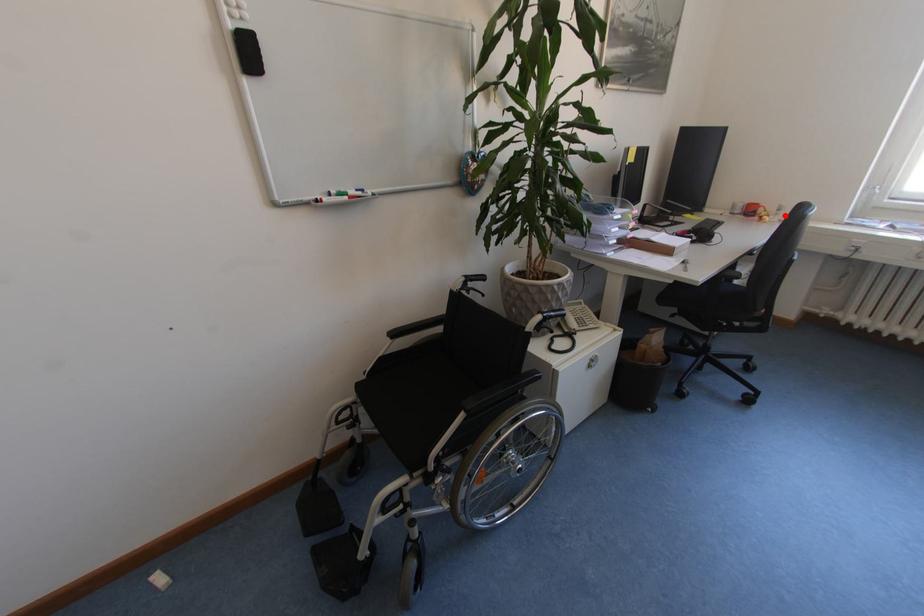
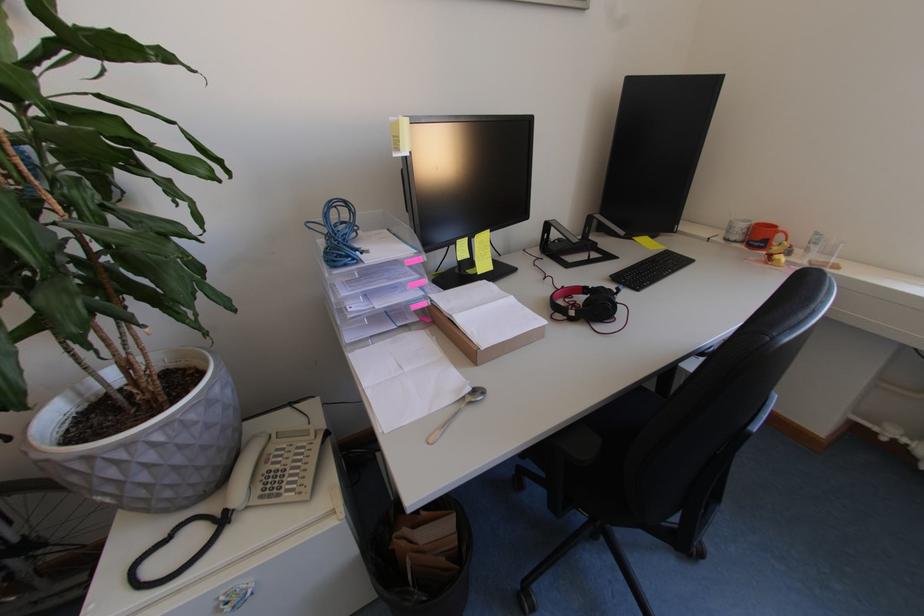
Find the pixel in the second image that matches the highlighted location in the first image.

(816, 253)